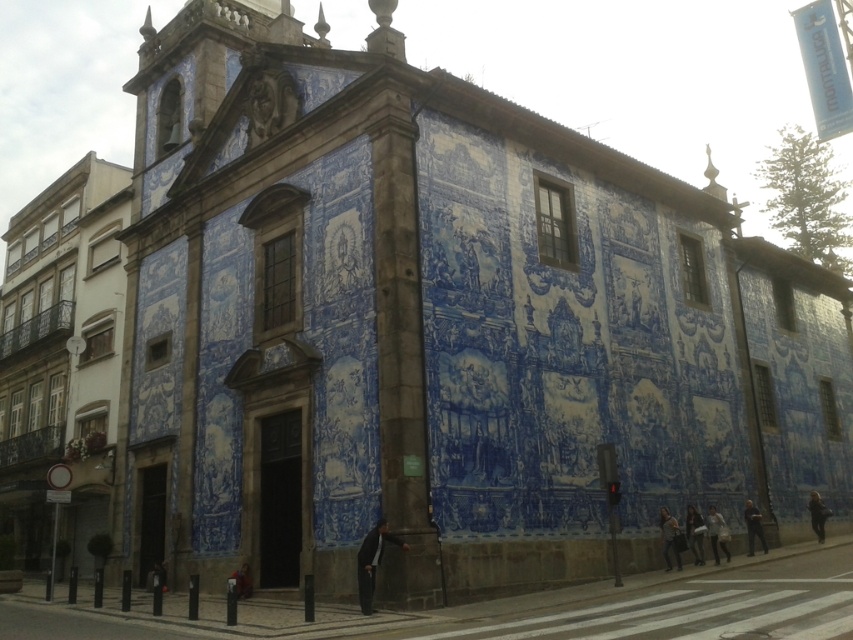
Is blue glazed tiles at left to the right of light brown leather jacket at lower right from the viewer's perspective?

In fact, blue glazed tiles at left is to the left of light brown leather jacket at lower right.

Who is more distant from viewer, (x=71, y=308) or (x=660, y=525)?

Positioned behind is point (x=71, y=308).

Is point (13, 227) farther from viewer compared to point (672, 545)?

That is True.

Where is `blue glazed tiles at left`? The width and height of the screenshot is (853, 640). blue glazed tiles at left is located at coordinates pyautogui.click(x=61, y=356).

Between dark gray fabric jacket at lower right and dark blue fabric jacket at center, which one is positioned higher?

dark gray fabric jacket at lower right

Find the location of `dark gray fabric jacket at lower right`. dark gray fabric jacket at lower right is located at coordinates (694, 532).

Is point (704, 531) positioned in front of point (235, 572)?

No.

Identify the location of dark gray fabric jacket at lower right. (694, 532).

Where is `dark gray suit at lower center`? This screenshot has width=853, height=640. dark gray suit at lower center is located at coordinates (372, 561).

Who is more distant from viewer, (370, 540) or (744, 515)?

Positioned behind is point (744, 515).

Where is `dark gray suit at lower center`? The image size is (853, 640). dark gray suit at lower center is located at coordinates tap(372, 561).